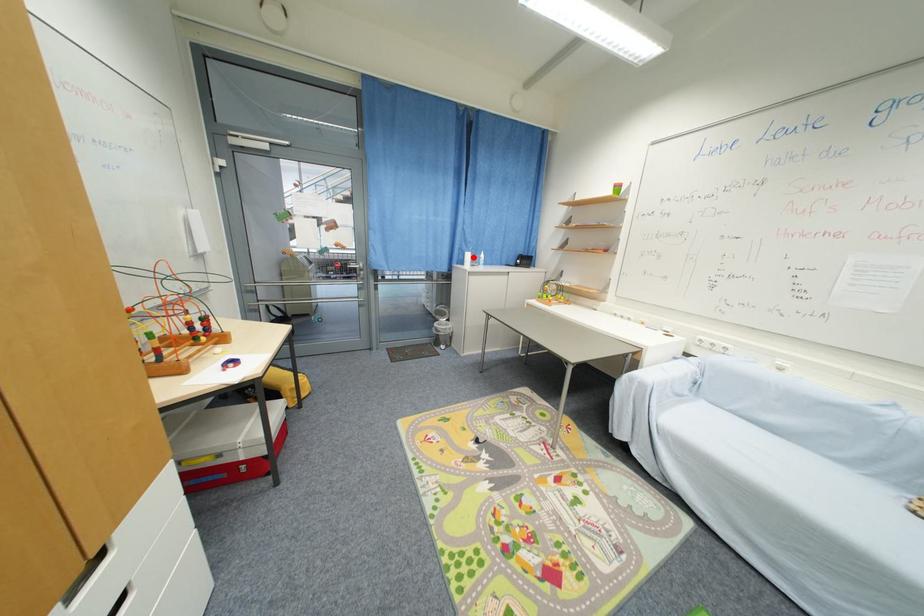
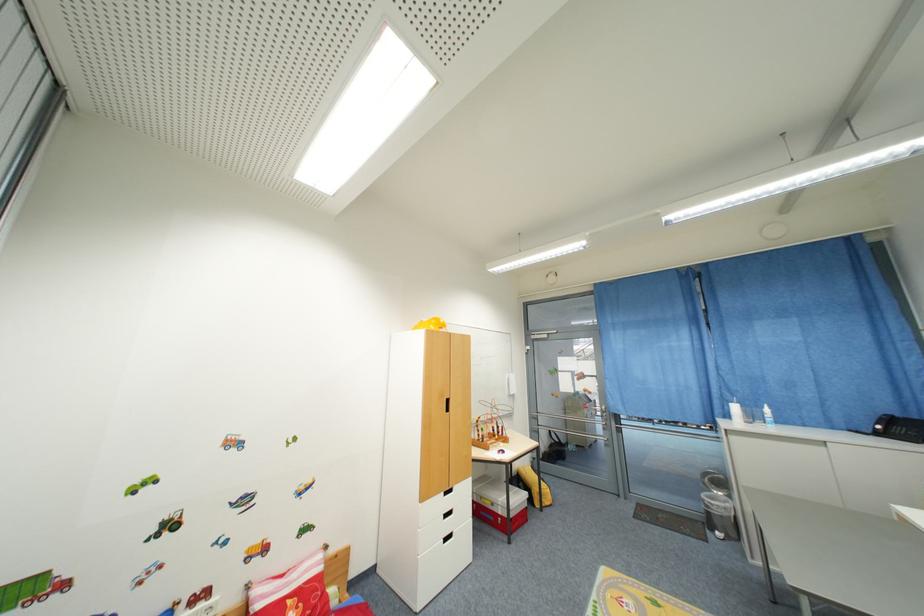
Question: A red point is marked in image1. In image2, is the corresponding 3D point closer to the camera or farther? Reply with the corresponding letter.

Choices:
 (A) The corresponding 3D point is closer.
 (B) The corresponding 3D point is farther.

Answer: (B)